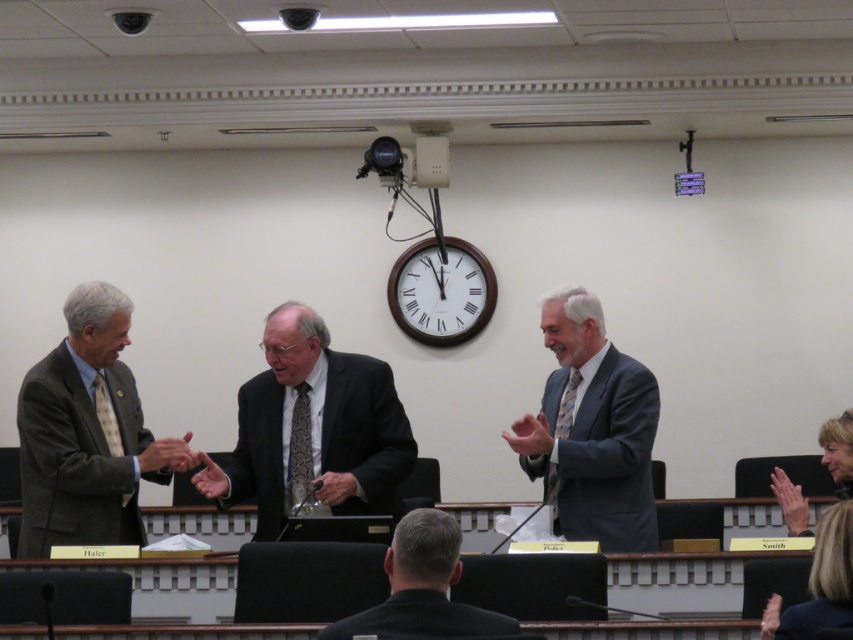
You are a photographer in this room and need to capture a photo of the matte gray suit at center and the black suit at center. Which one is on the right side when facing the suits?

The matte gray suit at center is positioned on the right side of the black suit at center, so when facing the suits, the matte gray suit at center is on the right side.

You are an event photographer who needs to capture a clear photo of both the matte gray suit at center and the black matte suit at center. Based on their positions, which one is closer to the camera?

The matte gray suit at center is closer to the camera because the black matte suit at center is behind it.